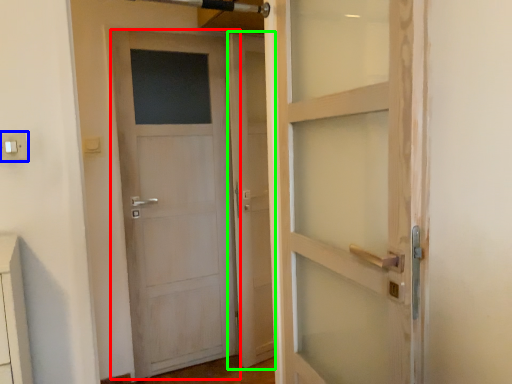
Question: Which is nearer to the door (highlighted by a red box)? electric outlet (highlighted by a blue box) or screen door (highlighted by a green box).

Choices:
 (A) electric outlet
 (B) screen door

Answer: (B)